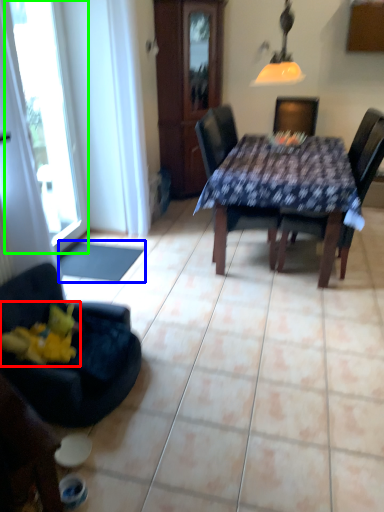
Question: Considering the real-world distances, which object is closest to toy (highlighted by a red box)? flat (highlighted by a blue box) or window (highlighted by a green box).

Choices:
 (A) flat
 (B) window

Answer: (A)